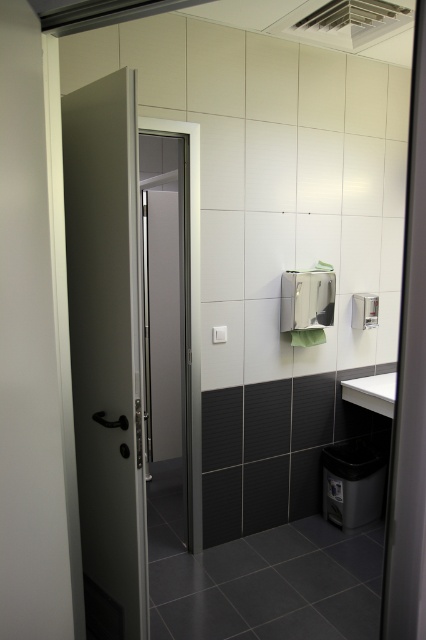
Question: Is matte gray door at left to the right of white glossy sink at right from the viewer's perspective?

Choices:
 (A) no
 (B) yes

Answer: (A)

Question: Which of the following is the closest to the observer?

Choices:
 (A) white glossy sink at right
 (B) matte gray door at left

Answer: (B)

Question: Does matte gray door at left lie in front of white glossy sink at right?

Choices:
 (A) no
 (B) yes

Answer: (B)

Question: Can you confirm if matte gray door at left is positioned below white glossy sink at right?

Choices:
 (A) yes
 (B) no

Answer: (B)